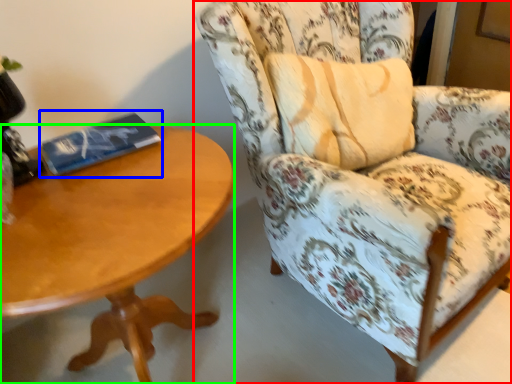
Question: Which is farther away from chair (highlighted by a red box)? paperback book (highlighted by a blue box) or coffee table (highlighted by a green box)?

Choices:
 (A) paperback book
 (B) coffee table

Answer: (A)